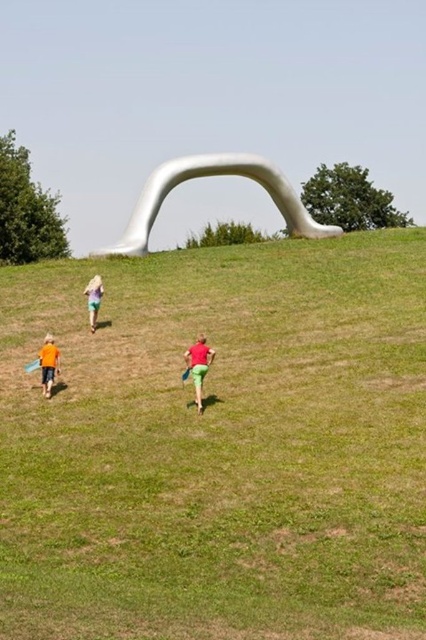
Question: Which object appears closest to the camera in this image?

Choices:
 (A) green grassy field at center
 (B) white matte arch at center
 (C) pastel green shorts at lower center
 (D) orange cotton shirt at lower left

Answer: (A)

Question: Which point appears farthest from the camera in this image?

Choices:
 (A) (103, 292)
 (B) (43, 340)
 (C) (201, 365)

Answer: (A)

Question: Can you confirm if green grassy field at center is positioned above orange cotton shirt at lower left?

Choices:
 (A) no
 (B) yes

Answer: (B)

Question: Is white matte arch at center to the left of orange cotton shirt at lower left from the viewer's perspective?

Choices:
 (A) yes
 (B) no

Answer: (B)

Question: Which object is closer to the camera taking this photo?

Choices:
 (A) orange cotton shirt at lower left
 (B) matte pink shirt at center
 (C) pastel green shorts at lower center

Answer: (B)

Question: From the image, what is the correct spatial relationship of white matte arch at center in relation to matte pink shirt at center?

Choices:
 (A) below
 (B) above

Answer: (B)